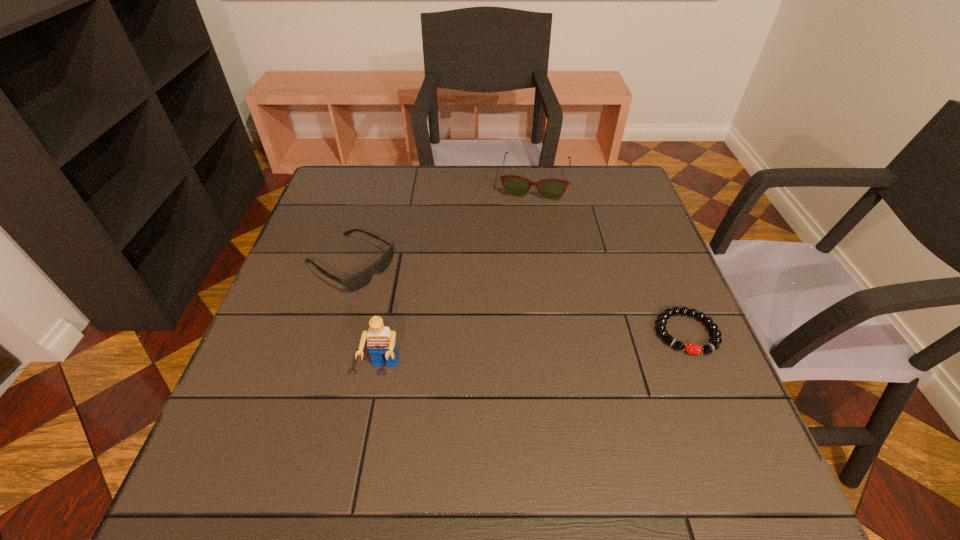
Locate an element on the screen. Image resolution: width=960 pixels, height=540 pixels. the tallest object is located at coordinates (381, 343).

Locate an element on the screen. the rightmost object is located at coordinates tap(691, 348).

Where is `bracelet`? This screenshot has height=540, width=960. bracelet is located at coordinates (691, 348).

Locate an element on the screen. This screenshot has height=540, width=960. the second farthest object is located at coordinates coord(353,283).

Image resolution: width=960 pixels, height=540 pixels. Identify the location of the second shortest object. (353, 283).

Locate an element on the screen. This screenshot has height=540, width=960. the third object from left to right is located at coordinates (516, 186).

The height and width of the screenshot is (540, 960). Find the location of `the farthest object`. the farthest object is located at coordinates (516, 186).

The width and height of the screenshot is (960, 540). Find the location of `free space located on the left of the rightmost object`. free space located on the left of the rightmost object is located at coordinates (515, 333).

Identify the location of vacant space positioned 0.130m on the front-facing side of the sunglasses. The height and width of the screenshot is (540, 960). (423, 308).

In order to click on vacant space located 0.190m on the front-facing side of the sunglasses in this screenshot , I will do `click(444, 320)`.